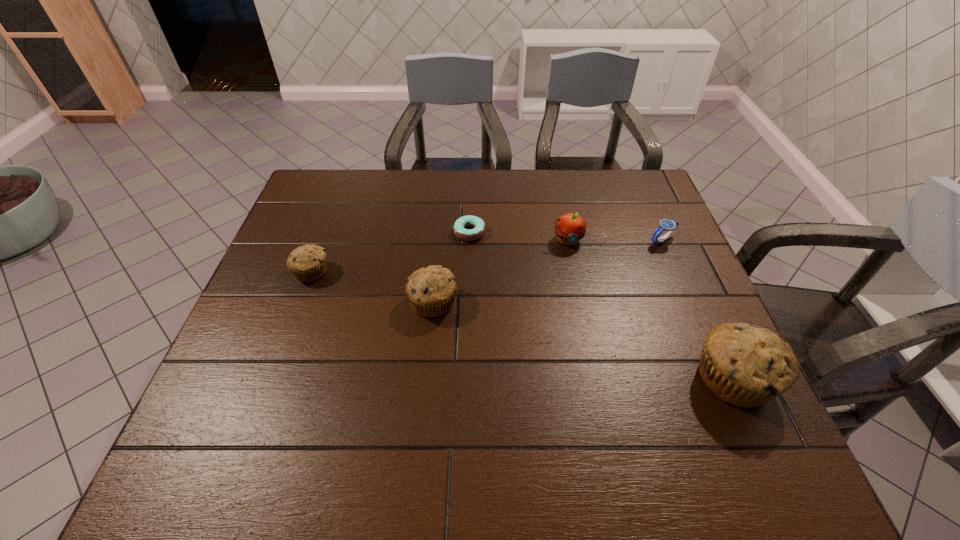
Where is `free space that satisfies the following two spatial constraints: 1. on the front side of the shortest muffin; 2. on the left side of the second muffin from right to left`? This screenshot has width=960, height=540. free space that satisfies the following two spatial constraints: 1. on the front side of the shortest muffin; 2. on the left side of the second muffin from right to left is located at coordinates (300, 302).